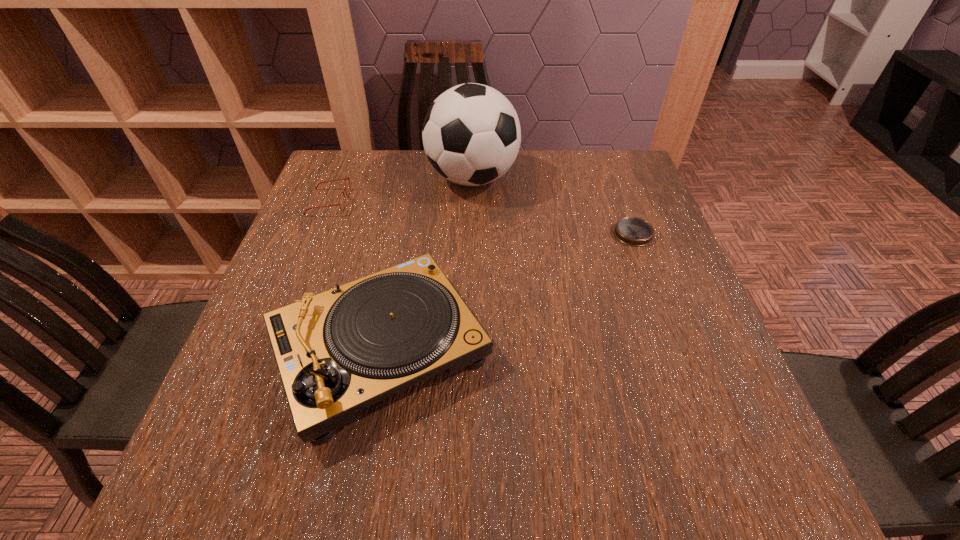
Where is `free spot that satisfies the following two spatial constraints: 1. on the face of the third tallest object; 2. on the right side of the rightmost object`? free spot that satisfies the following two spatial constraints: 1. on the face of the third tallest object; 2. on the right side of the rightmost object is located at coordinates (316, 234).

At what (x,y) coordinates should I click in order to perform the action: click on vacant region that satisfies the following two spatial constraints: 1. on the back side of the third farthest object; 2. on the face of the second shortest object. Please return your answer as a coordinate pair (x, y). The image size is (960, 540). Looking at the image, I should click on (621, 202).

Locate an element on the screen. The width and height of the screenshot is (960, 540). vacant point that satisfies the following two spatial constraints: 1. on the face of the shortest object; 2. on the left side of the spectacles is located at coordinates (316, 234).